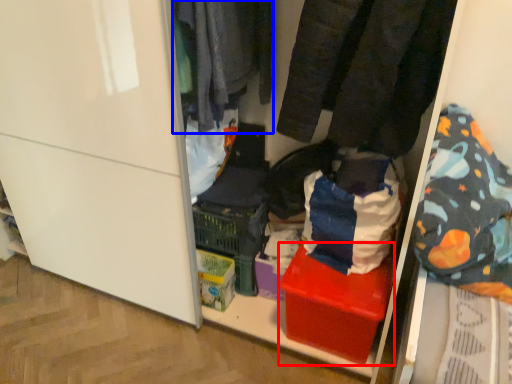
Question: Which point is further to the camera, box (highlighted by a red box) or clothing (highlighted by a blue box)?

Choices:
 (A) box
 (B) clothing

Answer: (A)